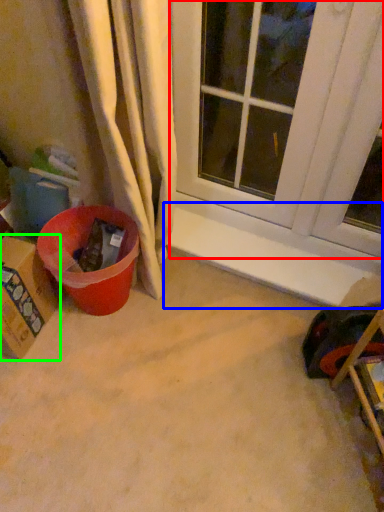
Question: Estimate the real-world distances between objects in this image. Which object is farther from window (highlighted by a red box), window sill (highlighted by a blue box) or cardboard box (highlighted by a green box)?

Choices:
 (A) window sill
 (B) cardboard box

Answer: (B)